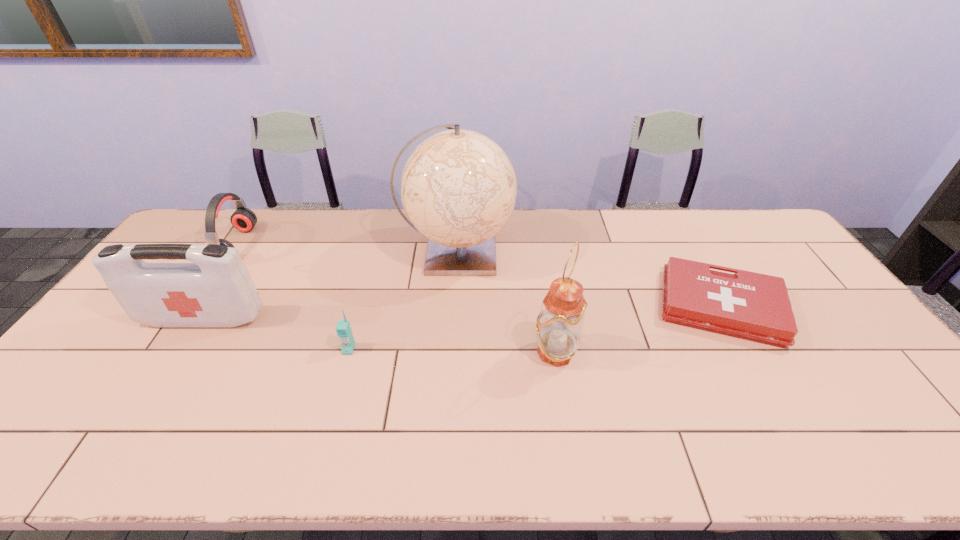
At what (x,y) coordinates should I click in order to perform the action: click on free spot that satisfies the following two spatial constraints: 1. on the surface of the shorter first-aid kit showing Europe and Africa; 2. on the right side of the globe. Please return your answer as a coordinate pair (x, y). The image size is (960, 540). Looking at the image, I should click on (454, 307).

Identify the location of free location that satisfies the following two spatial constraints: 1. on the ear cups of the rightmost object; 2. on the left side of the third shortest object. pyautogui.click(x=197, y=307).

This screenshot has width=960, height=540. What are the coordinates of `free spot that satisfies the following two spatial constraints: 1. on the surface of the tallest object showing Europe and Africa; 2. on the front side of the left first-aid kit` in the screenshot? It's located at (453, 318).

Where is `free space that satisfies the following two spatial constraints: 1. on the back side of the oil lamp; 2. on the surface of the third object from right to left showing Europe and Africa`? free space that satisfies the following two spatial constraints: 1. on the back side of the oil lamp; 2. on the surface of the third object from right to left showing Europe and Africa is located at coordinates (540, 253).

Where is `free location that satisfies the following two spatial constraints: 1. on the surface of the second tallest object showing Europe and Africa; 2. on the left side of the third object from right to left`? Image resolution: width=960 pixels, height=540 pixels. free location that satisfies the following two spatial constraints: 1. on the surface of the second tallest object showing Europe and Africa; 2. on the left side of the third object from right to left is located at coordinates (451, 352).

This screenshot has height=540, width=960. In order to click on vacant space that satisfies the following two spatial constraints: 1. on the surface of the tallest object showing Europe and Africa; 2. on the left side of the second tallest object in this screenshot , I will do pyautogui.click(x=451, y=352).

At what (x,y) coordinates should I click in order to perform the action: click on free space that satisfies the following two spatial constraints: 1. on the surface of the third object from right to left showing Europe and Africa; 2. on the front side of the left first-aid kit. Please return your answer as a coordinate pair (x, y). Looking at the image, I should click on (453, 318).